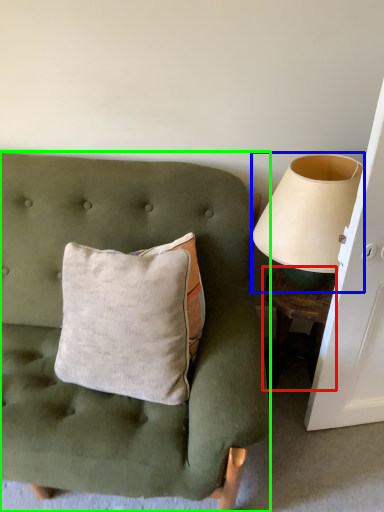
Question: Which object is positioned closest to table (highlighted by a red box)? Select from table lamp (highlighted by a blue box) and furniture (highlighted by a green box).

Choices:
 (A) table lamp
 (B) furniture

Answer: (A)